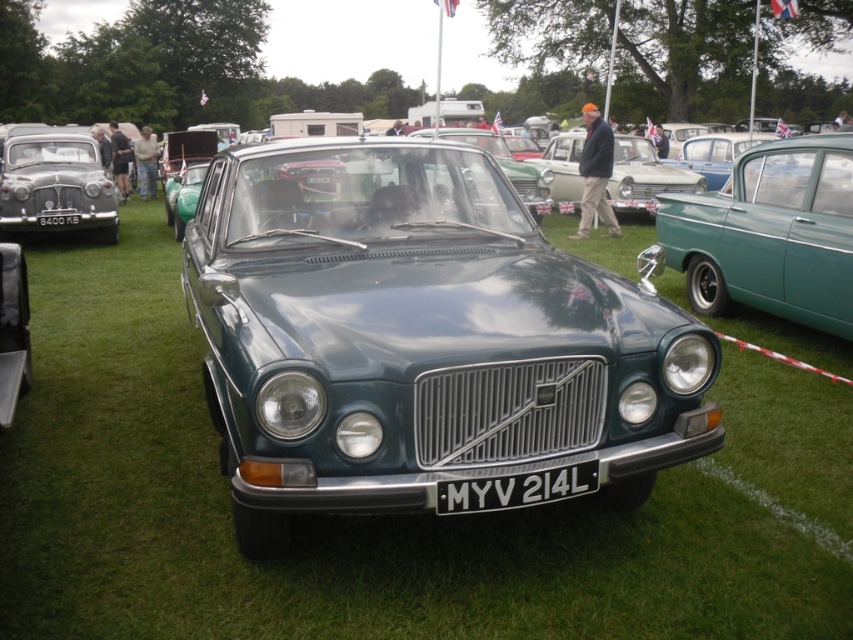
Question: Which point is farther from the camera taking this photo?

Choices:
 (A) (618, 196)
 (B) (48, 216)

Answer: (A)

Question: Does metallic blue car at center appear on the left side of white plastic license plate at center?

Choices:
 (A) no
 (B) yes

Answer: (B)

Question: Among these points, which one is nearest to the camera?

Choices:
 (A) click(668, 189)
 (B) click(51, 224)
 (C) click(106, 209)

Answer: (B)

Question: Which of the following is the farthest from the observer?

Choices:
 (A) (491, 484)
 (B) (79, 221)

Answer: (B)

Question: Is metallic blue sedan at center smaller than black metal/license plate at center?

Choices:
 (A) no
 (B) yes

Answer: (A)

Question: Is white plastic license plate at center to the right of black metal/license plate at center from the viewer's perspective?

Choices:
 (A) yes
 (B) no

Answer: (A)